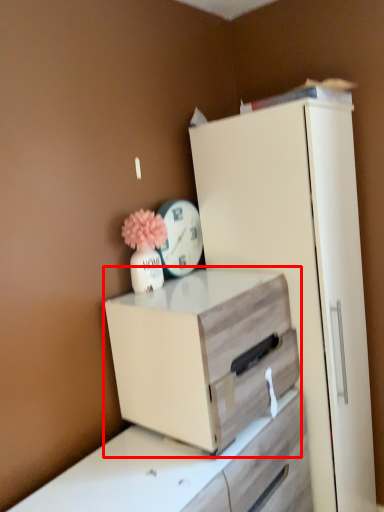
Question: Considering the relative positions of chest of drawers (annotated by the red box) and clock in the image provided, where is chest of drawers (annotated by the red box) located with respect to the staircase?

Choices:
 (A) left
 (B) right

Answer: (B)